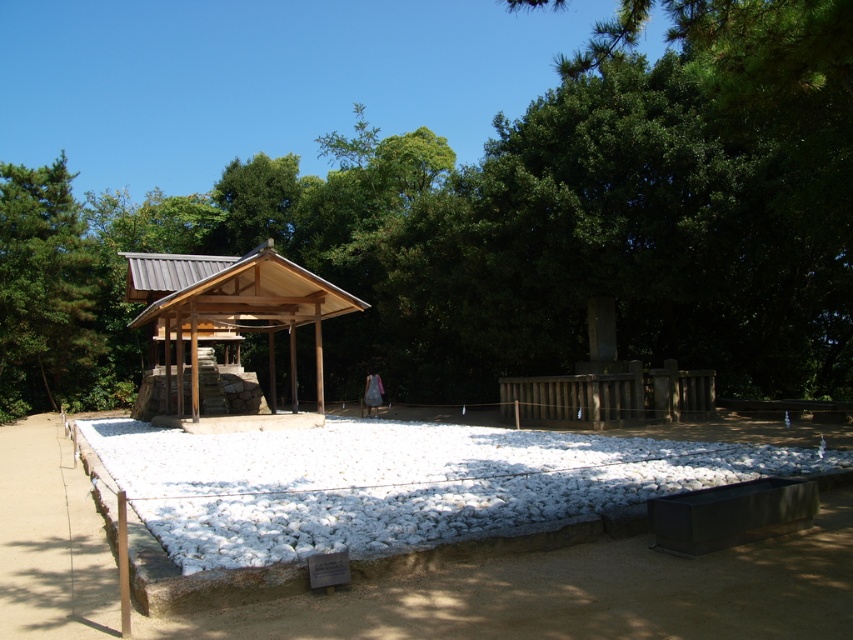
Does point (683, 243) lie behind point (149, 385)?

No.

Is green leafy tree at upper center smaller than wooden gazebo at center?

Incorrect, green leafy tree at upper center is not smaller in size than wooden gazebo at center.

Measure the distance between green leafy tree at upper center and camera.

green leafy tree at upper center is 23.13 feet away from camera.

This screenshot has width=853, height=640. I want to click on green leafy tree at upper center, so click(x=509, y=227).